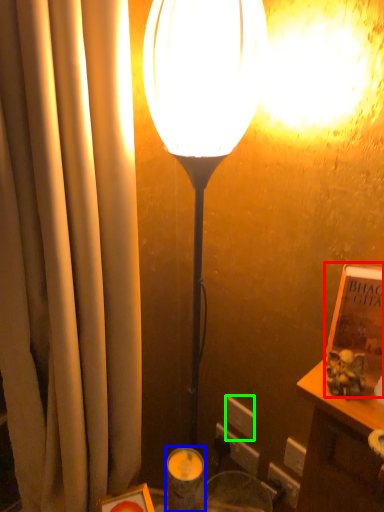
Question: Which object is the farthest from book (highlighted by a red box)? Choose among these: candle holder (highlighted by a blue box) or electric outlet (highlighted by a green box).

Choices:
 (A) candle holder
 (B) electric outlet

Answer: (B)